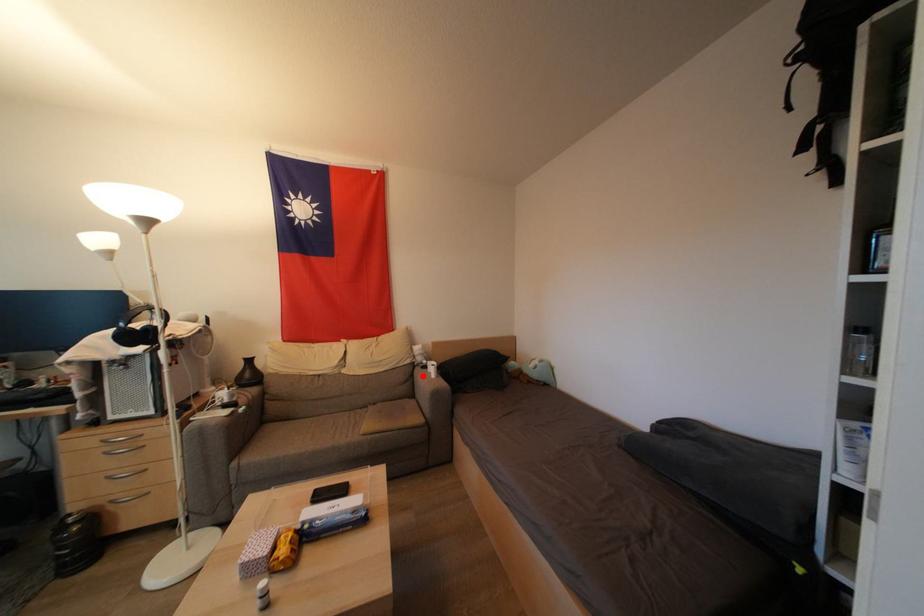
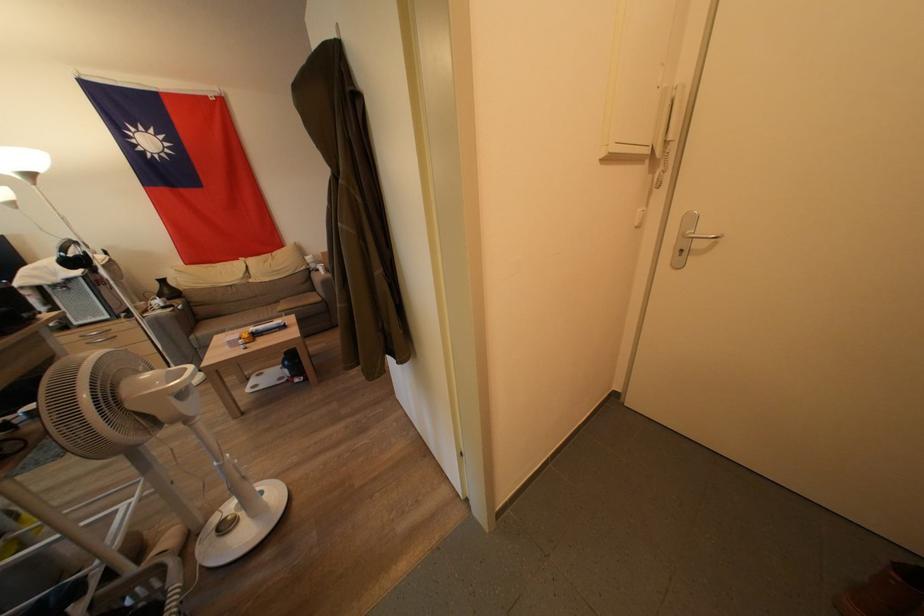
Question: I am providing you with two images of the same scene from different viewpoints. Given a red point in image1, look at the same physical point in image2. Is it:

Choices:
 (A) Closer to the viewpoint
 (B) Farther from the viewpoint

Answer: (B)